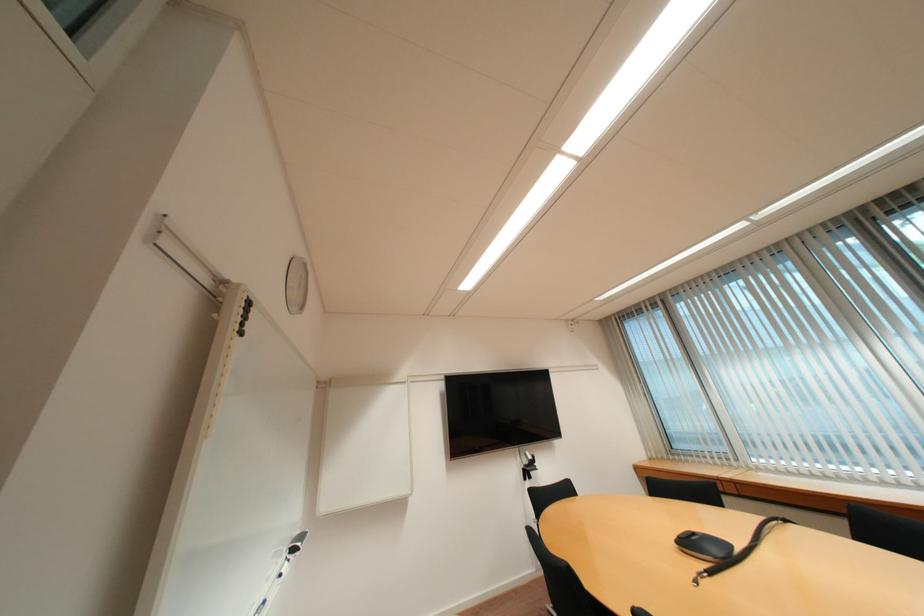
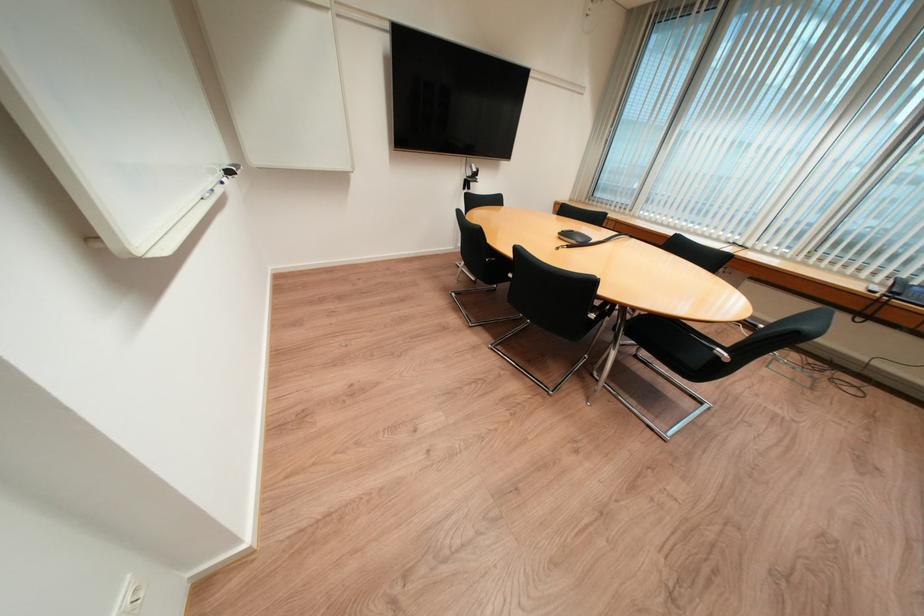
Locate, in the second image, the point that corresponds to the point at 286,575 in the first image.

(225, 180)